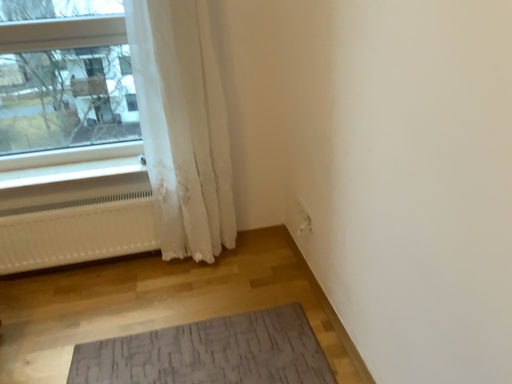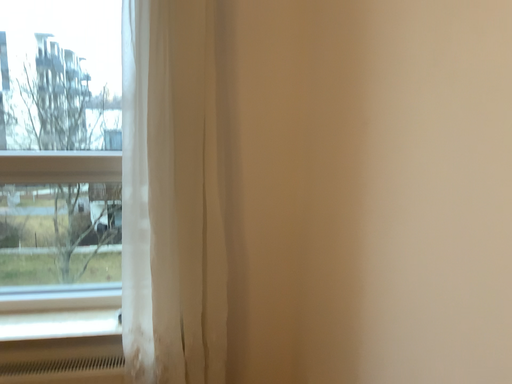
Question: How did the camera likely rotate when shooting the video?

Choices:
 (A) rotated upward
 (B) rotated downward

Answer: (A)